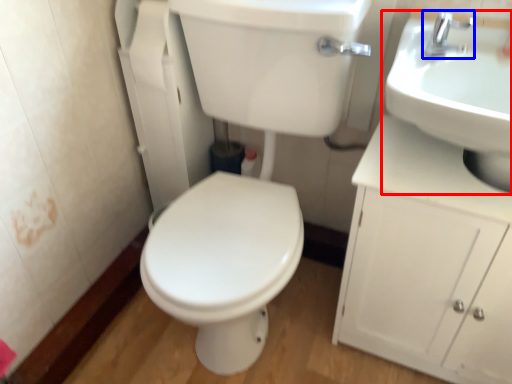
Question: Which object appears closest to the camera in this image, sink (highlighted by a red box) or tap (highlighted by a blue box)?

Choices:
 (A) sink
 (B) tap

Answer: (A)